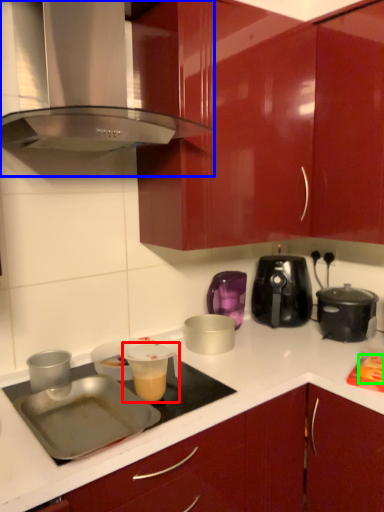
Question: Which object is positioned farthest from appliance (highlighted by a red box)? Select from home appliance (highlighted by a blue box) and food (highlighted by a green box).

Choices:
 (A) home appliance
 (B) food

Answer: (A)